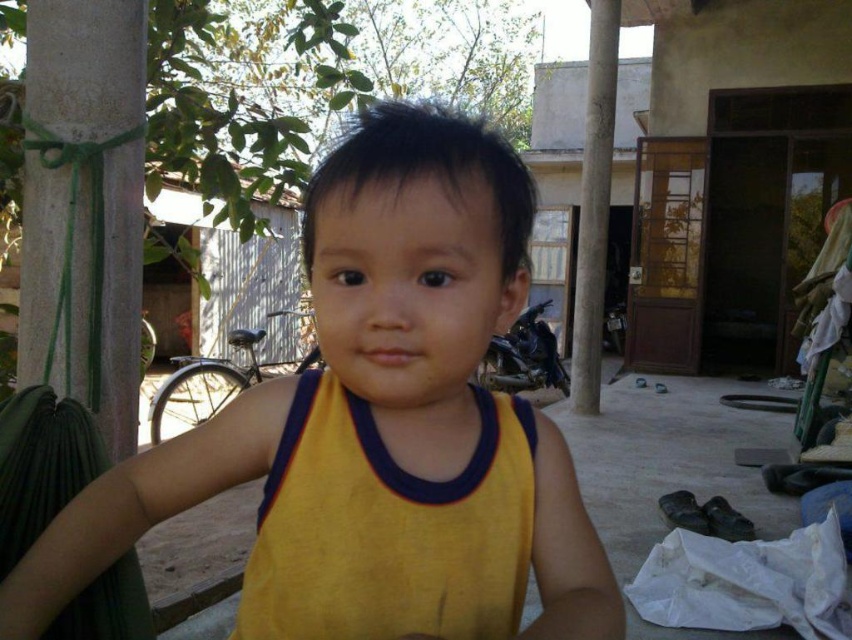
The user is trying to determine which yellow fabric item is on the left side. They see both the yellow fabric at center and the yellow fabric vest at center. Which one is positioned to the left?

The yellow fabric at center is positioned on the left side of the yellow fabric vest at center.